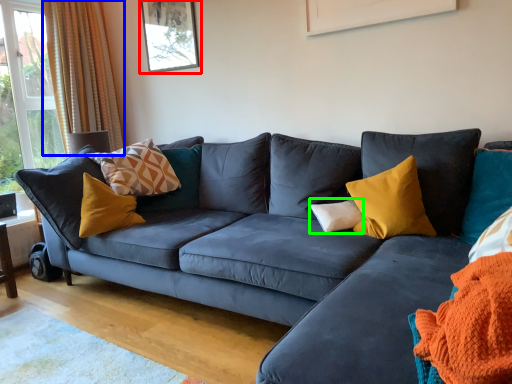
Question: Estimate the real-world distances between objects in this image. Which object is closer to picture frame (highlighted by a red box), curtain (highlighted by a blue box) or pillow (highlighted by a green box)?

Choices:
 (A) curtain
 (B) pillow

Answer: (A)